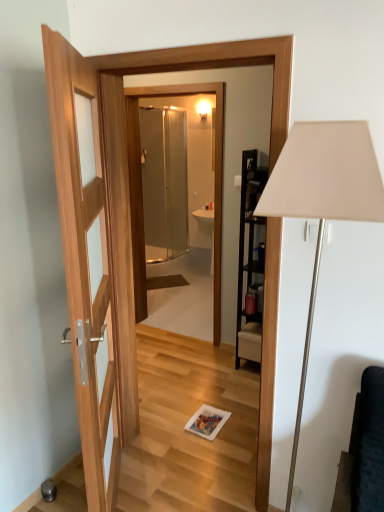
Question: From the image's perspective, does white matte floor lamp at right appear higher than clear glass shower door at center?

Choices:
 (A) yes
 (B) no

Answer: (B)

Question: Is white matte floor lamp at right with clear glass shower door at center?

Choices:
 (A) yes
 (B) no

Answer: (B)

Question: Does white matte floor lamp at right have a smaller size compared to clear glass shower door at center?

Choices:
 (A) yes
 (B) no

Answer: (A)

Question: Is white matte floor lamp at right outside of clear glass shower door at center?

Choices:
 (A) yes
 (B) no

Answer: (A)

Question: From a real-world perspective, is white matte floor lamp at right physically below clear glass shower door at center?

Choices:
 (A) no
 (B) yes

Answer: (B)

Question: Is clear glass shower door at center a part of white matte floor lamp at right?

Choices:
 (A) yes
 (B) no

Answer: (B)

Question: Considering the relative sizes of clear glass shower door at center and white matte floor lamp at right in the image provided, is clear glass shower door at center thinner than white matte floor lamp at right?

Choices:
 (A) no
 (B) yes

Answer: (A)

Question: Is the surface of clear glass shower door at center in direct contact with white matte floor lamp at right?

Choices:
 (A) no
 (B) yes

Answer: (A)

Question: Is clear glass shower door at center oriented towards white matte floor lamp at right?

Choices:
 (A) yes
 (B) no

Answer: (B)

Question: Is clear glass shower door at center to the left of white matte floor lamp at right from the viewer's perspective?

Choices:
 (A) no
 (B) yes

Answer: (B)

Question: Can you confirm if clear glass shower door at center is smaller than white matte floor lamp at right?

Choices:
 (A) no
 (B) yes

Answer: (A)

Question: From the image's perspective, is clear glass shower door at center on white matte floor lamp at right?

Choices:
 (A) no
 (B) yes

Answer: (B)

Question: Considering the relative sizes of white matte floor lamp at right and transparent glass shower at center in the image provided, is white matte floor lamp at right wider than transparent glass shower at center?

Choices:
 (A) yes
 (B) no

Answer: (A)